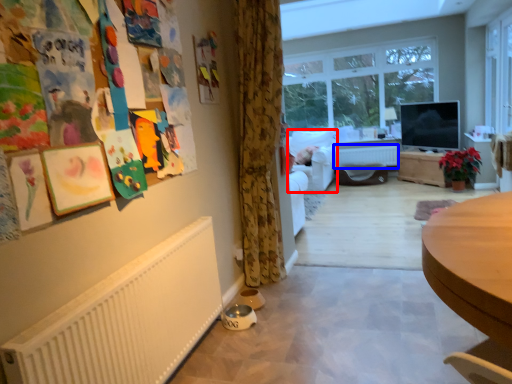
Question: Among these objects, which one is nearest to the camera, armchair (highlighted by a red box) or radiator (highlighted by a blue box)?

Choices:
 (A) armchair
 (B) radiator

Answer: (A)